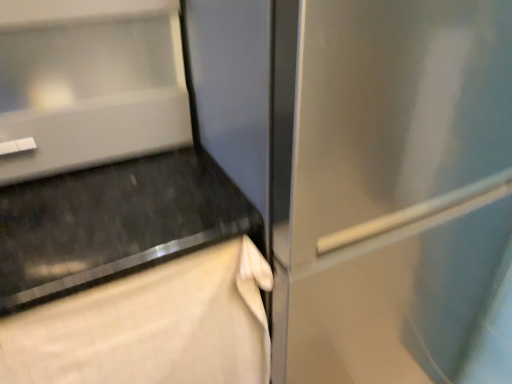
This screenshot has height=384, width=512. Identify the location of black granite countertop at lower left. (113, 222).

What do you see at coordinates (113, 222) in the screenshot? The image size is (512, 384). I see `black granite countertop at lower left` at bounding box center [113, 222].

The height and width of the screenshot is (384, 512). I want to click on black granite countertop at lower left, so click(113, 222).